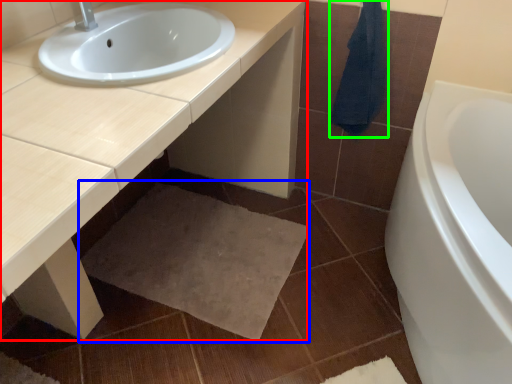
Question: Which object is the closest to the countertop (highlighted by a red box)? Choose among these: bath mat (highlighted by a blue box) or bath towel (highlighted by a green box).

Choices:
 (A) bath mat
 (B) bath towel

Answer: (B)